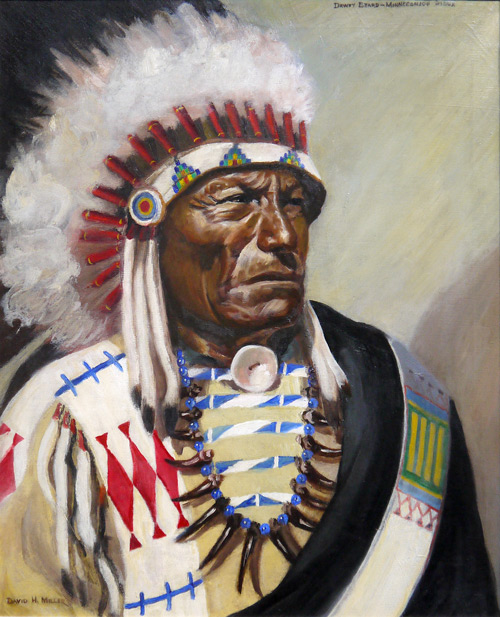
The width and height of the screenshot is (500, 617). Find the location of `sash`. sash is located at coordinates (419, 558).